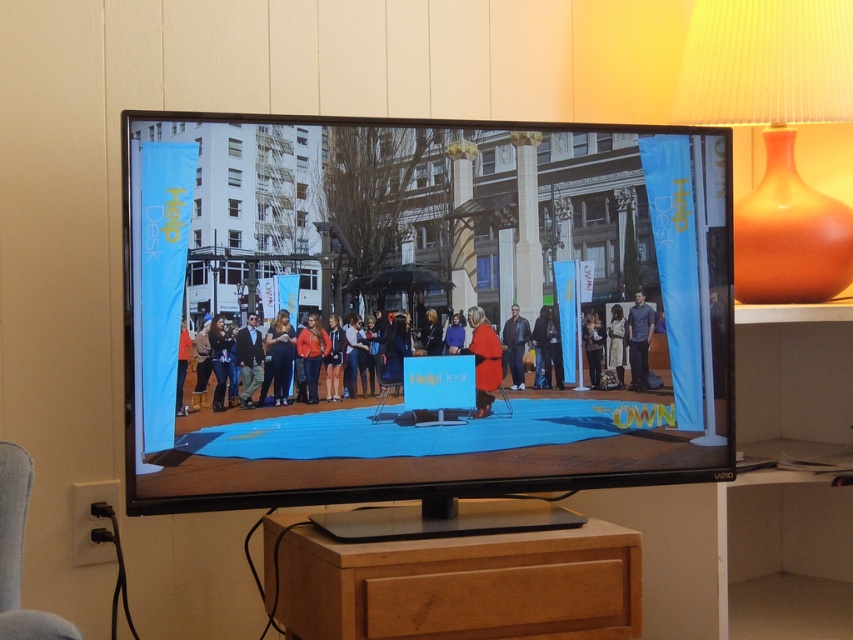
Between point (306, 349) and point (590, 326), which one is positioned in front?

Positioned in front is point (306, 349).

Which is above, matte orange jacket at center or dark gray sweater at center?

dark gray sweater at center is above.

Is point (308, 396) farther from viewer compared to point (595, 342)?

No.

At what (x,y) coordinates should I click in order to perform the action: click on matte orange jacket at center. Please return your answer as a coordinate pair (x, y). This screenshot has height=640, width=853. Looking at the image, I should click on (312, 353).

Between wooden dresser at center and blue fabric person at right, which one has more height?

wooden dresser at center is taller.

Is point (567, 600) more distant than point (628, 314)?

No, it is in front of (628, 314).

Image resolution: width=853 pixels, height=640 pixels. Identify the location of wooden dresser at center. (456, 584).

What do you see at coordinates (483, 358) in the screenshot? The width and height of the screenshot is (853, 640). I see `red matte coat at center` at bounding box center [483, 358].

Can you confirm if red matte coat at center is positioned to the right of matte orange jacket at center?

Indeed, red matte coat at center is positioned on the right side of matte orange jacket at center.

Is point (492, 355) closer to camera compared to point (305, 332)?

No, (492, 355) is further to viewer.

Where is `red matte coat at center`? Image resolution: width=853 pixels, height=640 pixels. red matte coat at center is located at coordinates (483, 358).